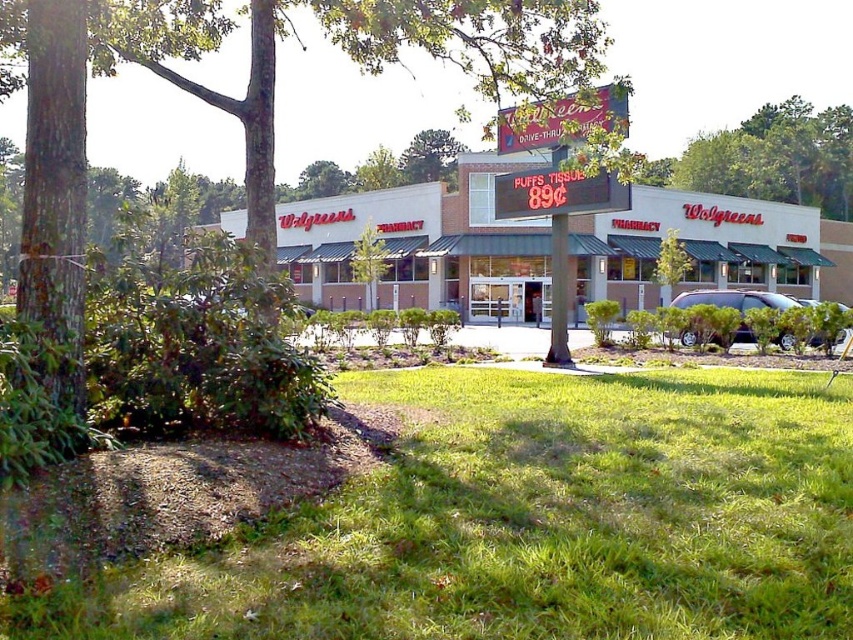
Question: Can you confirm if green leafy tree at center is positioned to the right of metallic red sign at center?

Choices:
 (A) yes
 (B) no

Answer: (B)

Question: Which object is the closest to the metallic red sign at center?

Choices:
 (A) green grass at lower center
 (B) white matte building at center

Answer: (A)

Question: Which of the following is the farthest from the observer?

Choices:
 (A) metallic red sign at center
 (B) green grass at lower center
 (C) green leafy tree at center
 (D) white matte building at center

Answer: (D)

Question: Is white matte building at center to the left of metallic red sign at center from the viewer's perspective?

Choices:
 (A) yes
 (B) no

Answer: (B)

Question: Is the position of green grass at lower center less distant than that of metallic red sign at center?

Choices:
 (A) yes
 (B) no

Answer: (A)

Question: Which point is closer to the camera?

Choices:
 (A) (254, 92)
 (B) (585, 477)

Answer: (B)